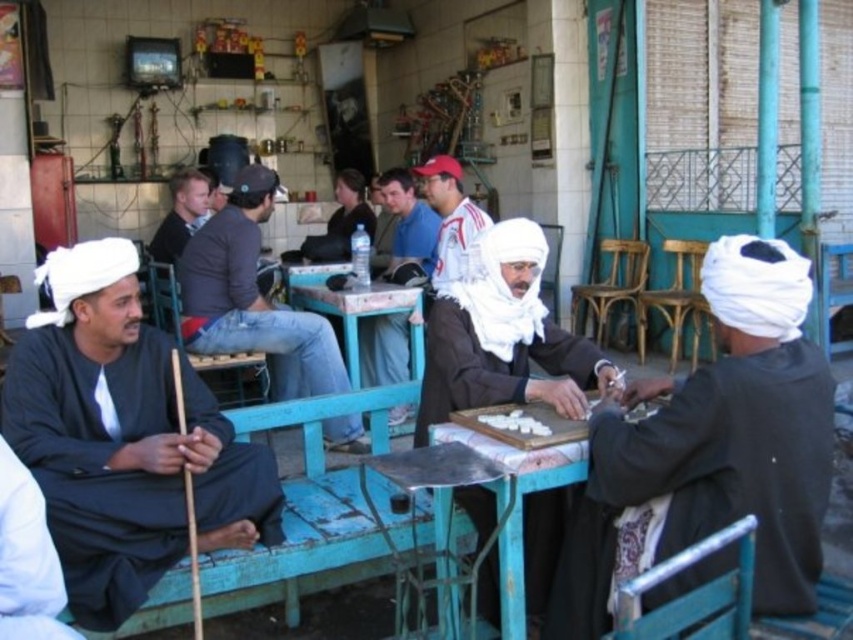
You are a delivery person who needs to place a package on the closest object between the dark brown fabric at center and the blue wooden table at center. Which object should you choose?

The dark brown fabric at center is 2.34 meters away from the blue wooden table at center. Since the blue wooden table at center is the closest object to you, you should place the package there.

You are a spectator observing the domino game between the two men. The black cotton stick at left and the white matte game pieces at center are on the table. Which object is located to the left of the other?

The black cotton stick at left is positioned on the left side of white matte game pieces at center.

You are a photographer standing at the edge of the scene. You want to capture a photo that includes both the dark brown fabric at center and the blue denim jeans at center. The camera you are using has a maximum focal length that allows capturing objects up to 8 feet apart. Will you be able to include both objects in the same frame?

The dark brown fabric at center and blue denim jeans at center are 8.50 feet apart from each other. Since the maximum distance the camera can capture is 8 feet, the objects are slightly too far apart to fit within the same frame.